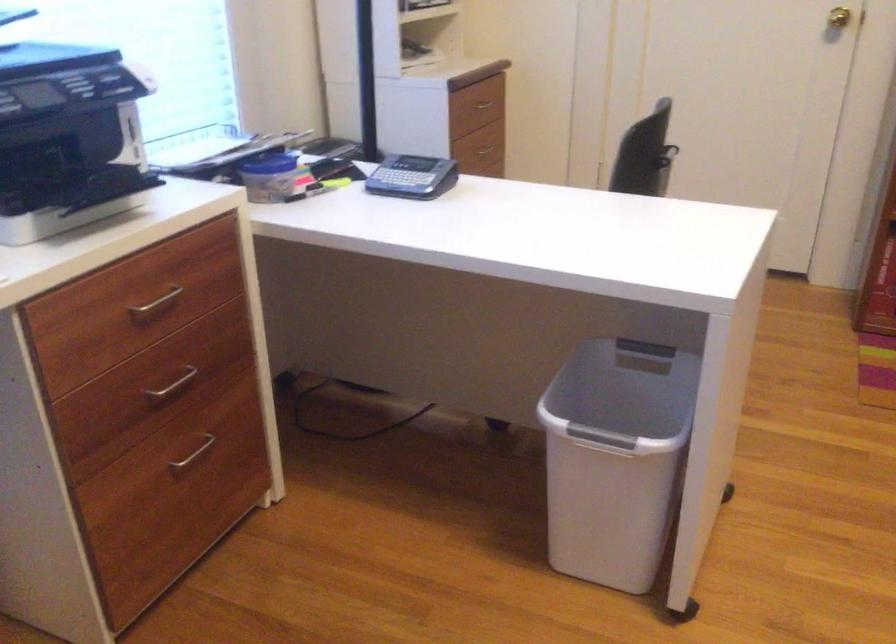
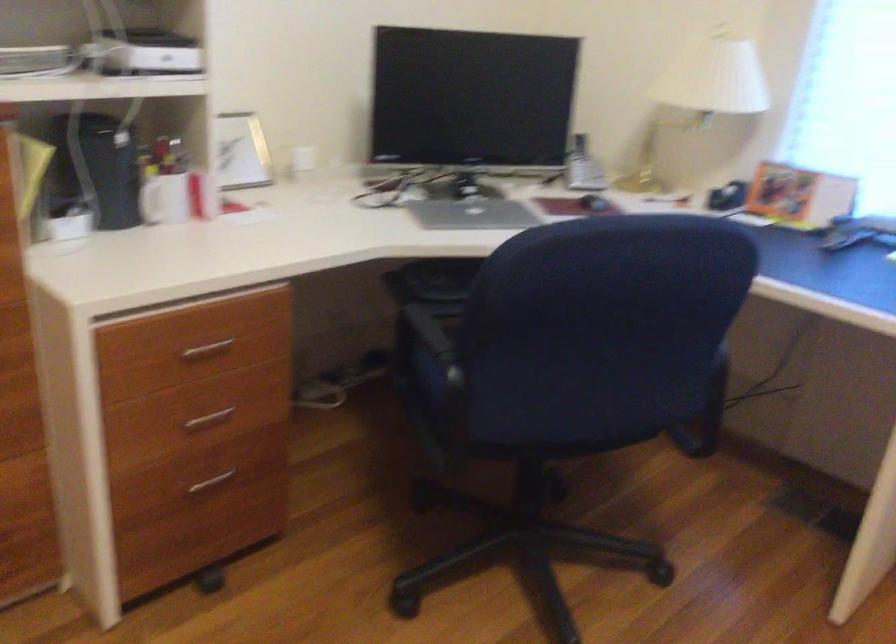
Looking at this image, the images are taken continuously from a first-person perspective. In which direction is your viewpoint rotating?

The camera's rotation is toward left-down.